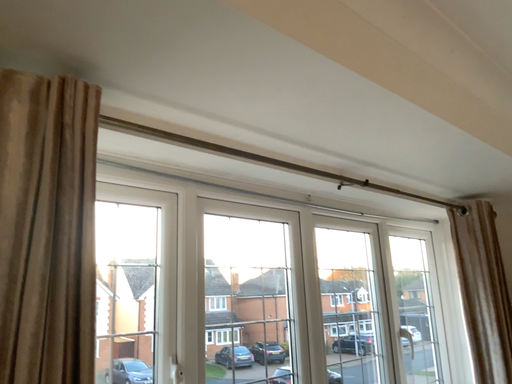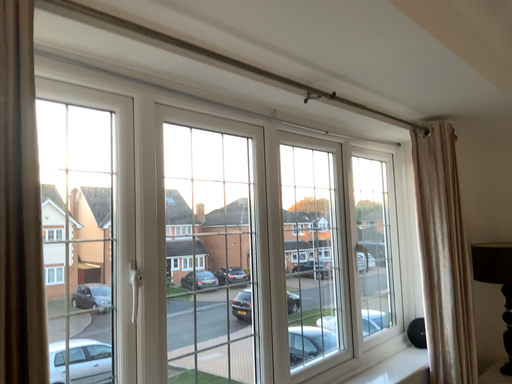
Question: Which way did the camera rotate in the video?

Choices:
 (A) rotated upward
 (B) rotated downward

Answer: (B)